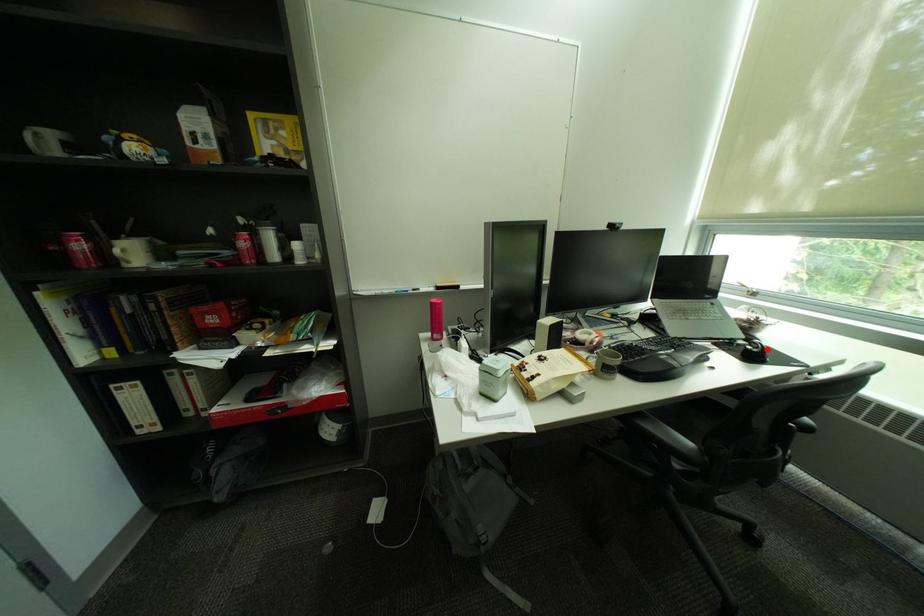
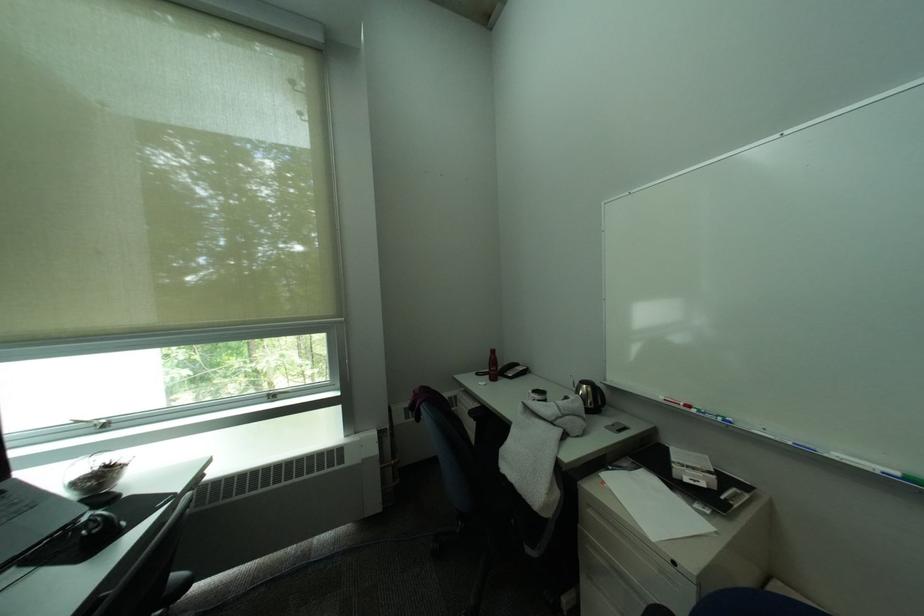
Locate, in the second image, the point that corresponds to the highlighted location in the first image.

(106, 528)